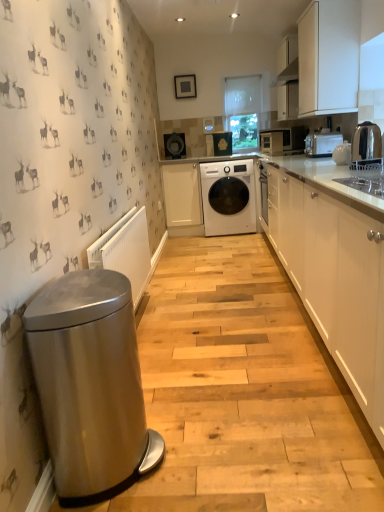
Identify the location of white glossy cabinets at right, arranged as the second cabinetry when viewed from the left. (334, 275).

In order to click on polished stainless steel kettle at right in this screenshot , I will do (x=366, y=145).

Where is `matte black microwave at upper right, the 1th home appliance positioned from the top`? matte black microwave at upper right, the 1th home appliance positioned from the top is located at coordinates pos(283,140).

What is the approximate height of matte white microwave at center, which is the 3th appliance from left to right?

matte white microwave at center, which is the 3th appliance from left to right, is 8.36 inches tall.

The width and height of the screenshot is (384, 512). Describe the element at coordinates (174, 145) in the screenshot. I see `matte black washing machine at center, positioned as the fourth appliance in right-to-left order` at that location.

In the scene shown: Measure the distance between point (165, 137) and camera.

15.89 feet.

The height and width of the screenshot is (512, 384). I want to click on white plastic radiator at lower left, so click(x=125, y=250).

Consider the image. Could you tell me if stainless steel trash can at left is facing white glossy cabinets at right, acting as the first cabinetry starting from the front?

Yes, stainless steel trash can at left is facing white glossy cabinets at right, acting as the first cabinetry starting from the front.

Is point (58, 426) positioned behind point (287, 170)?

That is False.

Is stainless steel trash can at left placed right next to white glossy cabinets at right, marked as the 3th cabinetry in a back-to-front arrangement?

No, stainless steel trash can at left is not with white glossy cabinets at right, marked as the 3th cabinetry in a back-to-front arrangement.

Which of these two, stainless steel trash can at left or white glossy cabinets at right, arranged as the second cabinetry when viewed from the left, is smaller?

With smaller size is stainless steel trash can at left.

Does white matte cabinet at upper right, which is the 2th cabinetry in front-to-back order, have a smaller size compared to white plastic radiator at lower left?

No, white matte cabinet at upper right, which is the 2th cabinetry in front-to-back order, is not smaller than white plastic radiator at lower left.

Looking at this image, from the image's perspective, would you say white matte cabinet at upper right, the second cabinetry in the back-to-front sequence, is shown under white plastic radiator at lower left?

Actually, white matte cabinet at upper right, the second cabinetry in the back-to-front sequence, appears above white plastic radiator at lower left in the image.

Is white matte cabinet at upper right, the third cabinetry positioned from the left, not inside white plastic radiator at lower left?

Yes, white matte cabinet at upper right, the third cabinetry positioned from the left, is outside of white plastic radiator at lower left.

Based on the photo, visually, is white matte cabinet at upper right, the second cabinetry in the back-to-front sequence, positioned to the left or to the right of white plastic radiator at lower left?

Clearly, white matte cabinet at upper right, the second cabinetry in the back-to-front sequence, is on the right of white plastic radiator at lower left in the image.

Measure the distance from matte black washing machine at center, which is counted as the fourth appliance, starting from the front, to white matte cabinet at center, which ranks as the third cabinetry in right-to-left order.

matte black washing machine at center, which is counted as the fourth appliance, starting from the front, is 22.47 inches from white matte cabinet at center, which ranks as the third cabinetry in right-to-left order.

From a real-world perspective, which cabinetry is the 2nd one underneath the matte black washing machine at center, which is the 2th appliance from left to right? Please provide its 2D coordinates.

[(182, 194)]

Is matte black washing machine at center, which is counted as the first appliance, starting from the top, facing towards white matte cabinet at center, which is counted as the 1th cabinetry, starting from the left?

No, matte black washing machine at center, which is counted as the first appliance, starting from the top, is not turned towards white matte cabinet at center, which is counted as the 1th cabinetry, starting from the left.

From the image's perspective, is matte black washing machine at center, the third appliance positioned from the right, under white matte cabinet at center, which ranks as the third cabinetry in right-to-left order?

Actually, matte black washing machine at center, the third appliance positioned from the right, appears above white matte cabinet at center, which ranks as the third cabinetry in right-to-left order, in the image.

Considering the sizes of objects white glossy washing machine at center and metallic silver toaster at upper right, which ranks as the 1th home appliance in bottom-to-top order, in the image provided, who is shorter, white glossy washing machine at center or metallic silver toaster at upper right, which ranks as the 1th home appliance in bottom-to-top order,?

With less height is metallic silver toaster at upper right, which ranks as the 1th home appliance in bottom-to-top order.

Could you measure the distance between white glossy washing machine at center and metallic silver toaster at upper right, which ranks as the 1th home appliance in bottom-to-top order?

A distance of 4.52 feet exists between white glossy washing machine at center and metallic silver toaster at upper right, which ranks as the 1th home appliance in bottom-to-top order.

Is point (245, 170) in front of point (323, 142)?

No, (245, 170) is further to viewer.

From the image's perspective, is white glossy washing machine at center above or below metallic silver toaster at upper right, the second home appliance from the top?

Clearly, from the image's perspective, white glossy washing machine at center is below metallic silver toaster at upper right, the second home appliance from the top.

Is matte black washing machine at center, marked as the 3th appliance in a bottom-to-top arrangement, oriented away from white ceramic teapot at upper right, arranged as the 1th appliance when ordered from the bottom?

No, matte black washing machine at center, marked as the 3th appliance in a bottom-to-top arrangement,'s orientation is not away from white ceramic teapot at upper right, arranged as the 1th appliance when ordered from the bottom.

Is matte black washing machine at center, positioned as the first appliance in left-to-right order, behind white ceramic teapot at upper right, the 1th appliance when ordered from right to left?

Yes, it is behind white ceramic teapot at upper right, the 1th appliance when ordered from right to left.

Which object is positioned more to the left, matte black washing machine at center, acting as the second appliance starting from the top, or white ceramic teapot at upper right, which is counted as the fourth appliance, starting from the left?

matte black washing machine at center, acting as the second appliance starting from the top, is more to the left.

From a real-world perspective, count 3rd appliances upward from the white ceramic teapot at upper right, the 4th appliance from the top, and point to it. Please provide its 2D coordinates.

[(174, 145)]

From a real-world perspective, is white glossy cabinets at right, acting as the first cabinetry starting from the front, above or below metallic silver toaster at upper right, the second home appliance positioned from the back?

In terms of real-world spatial position, white glossy cabinets at right, acting as the first cabinetry starting from the front, is below metallic silver toaster at upper right, the second home appliance positioned from the back.

Consider the image. Is white glossy cabinets at right, arranged as the second cabinetry when viewed from the left, far from metallic silver toaster at upper right, the second home appliance from the top?

No, white glossy cabinets at right, arranged as the second cabinetry when viewed from the left, is not far from metallic silver toaster at upper right, the second home appliance from the top.

Looking at this image, which is in front, white glossy cabinets at right, acting as the first cabinetry starting from the front, or metallic silver toaster at upper right, which ranks as the 1th home appliance in bottom-to-top order?

Positioned in front is white glossy cabinets at right, acting as the first cabinetry starting from the front.

In terms of width, does white plastic radiator at lower left look wider or thinner when compared to white matte cabinet at upper right, the second cabinetry in the back-to-front sequence?

Clearly, white plastic radiator at lower left has less width compared to white matte cabinet at upper right, the second cabinetry in the back-to-front sequence.

Measure the distance between white plastic radiator at lower left and white matte cabinet at upper right, placed as the first cabinetry when sorted from right to left.

1.77 meters.

Are white plastic radiator at lower left and white matte cabinet at upper right, placed as the first cabinetry when sorted from right to left, far apart?

white plastic radiator at lower left is far away from white matte cabinet at upper right, placed as the first cabinetry when sorted from right to left.

From a real-world perspective, is white plastic radiator at lower left on white matte cabinet at upper right, which is the 2th cabinetry in front-to-back order?

No, from a real-world perspective, white plastic radiator at lower left is not over white matte cabinet at upper right, which is the 2th cabinetry in front-to-back order

There is a stainless steel trash can at left. At what (x,y) coordinates should I click in order to perform the action: click on the 1st cabinetry above it (from the image's perspective). Please return your answer as a coordinate pair (x, y). Looking at the image, I should click on (334, 275).

This screenshot has width=384, height=512. What are the coordinates of `radiator that appears below the white matte cabinet at upper right, placed as the first cabinetry when sorted from right to left (from a real-world perspective)` in the screenshot? It's located at (125, 250).

Estimate the real-world distances between objects in this image. Which object is closer to white matte cabinet at upper right, the second cabinetry in the back-to-front sequence, white glossy washing machine at center or matte black washing machine at center, which is the 2th appliance from left to right?

white glossy washing machine at center lies closer to white matte cabinet at upper right, the second cabinetry in the back-to-front sequence, than the other object.

Looking at the image, which one is located further to matte black microwave at upper right, the 1th home appliance positioned from the top, matte white microwave at center, which is the 3th appliance from left to right, or white matte cabinet at center, which is the first cabinetry from back to front?

Among the two, white matte cabinet at center, which is the first cabinetry from back to front, is located further to matte black microwave at upper right, the 1th home appliance positioned from the top.

From the image, which object appears to be nearer to white glossy washing machine at center, white glossy cabinets at right, marked as the 3th cabinetry in a back-to-front arrangement, or white matte cabinet at center, which is counted as the 1th cabinetry, starting from the left?

white matte cabinet at center, which is counted as the 1th cabinetry, starting from the left, lies closer to white glossy washing machine at center than the other object.

In the scene shown: Estimate the real-world distances between objects in this image. Which object is closer to white matte cabinet at upper right, which is the 2th cabinetry in front-to-back order, metallic silver toaster at upper right, which appears as the first home appliance when viewed from the front, or polished stainless steel kettle at right?

The object closer to white matte cabinet at upper right, which is the 2th cabinetry in front-to-back order, is polished stainless steel kettle at right.

From the image, which object appears to be farther from white glossy washing machine at center, white glossy cabinets at right, which is counted as the 2th cabinetry, starting from the right, or white matte cabinet at upper right, the second cabinetry in the back-to-front sequence?

white glossy cabinets at right, which is counted as the 2th cabinetry, starting from the right.

Considering their positions, is matte black washing machine at center, acting as the second appliance starting from the top, positioned further to white ceramic teapot at upper right, marked as the 1th appliance in a front-to-back arrangement, than matte white microwave at center, which is the 3th appliance from left to right?

matte black washing machine at center, acting as the second appliance starting from the top.

Based on their spatial positions, is matte black washing machine at center, positioned as the fourth appliance in right-to-left order, or matte black microwave at upper right, placed as the second home appliance when sorted from front to back, further from stainless steel trash can at left?

The object further to stainless steel trash can at left is matte black washing machine at center, positioned as the fourth appliance in right-to-left order.

From the image, which object appears to be nearer to matte white microwave at center, placed as the second appliance when sorted from right to left, metallic silver toaster at upper right, the second home appliance from the top, or stainless steel trash can at left?

metallic silver toaster at upper right, the second home appliance from the top, is closer to matte white microwave at center, placed as the second appliance when sorted from right to left.

Image resolution: width=384 pixels, height=512 pixels. Find the location of `home appliance between stainless steel trash can at left and matte white microwave at center, which ranks as the third appliance in top-to-bottom order, along the z-axis`. home appliance between stainless steel trash can at left and matte white microwave at center, which ranks as the third appliance in top-to-bottom order, along the z-axis is located at coordinates (322, 143).

Find the location of a particular element. The height and width of the screenshot is (512, 384). washing machine between white ceramic teapot at upper right, which is the 4th appliance in back-to-front order, and matte black microwave at upper right, the second home appliance when ordered from bottom to top, along the z-axis is located at coordinates (228, 197).

Identify the location of kitchen appliance located between white plastic radiator at lower left and white matte cabinet at center, which is the first cabinetry from back to front, in the depth direction. [x=366, y=145].

Identify the location of appliance located between polished stainless steel kettle at right and metallic silver toaster at upper right, the second home appliance positioned from the back, in the depth direction. (342, 153).